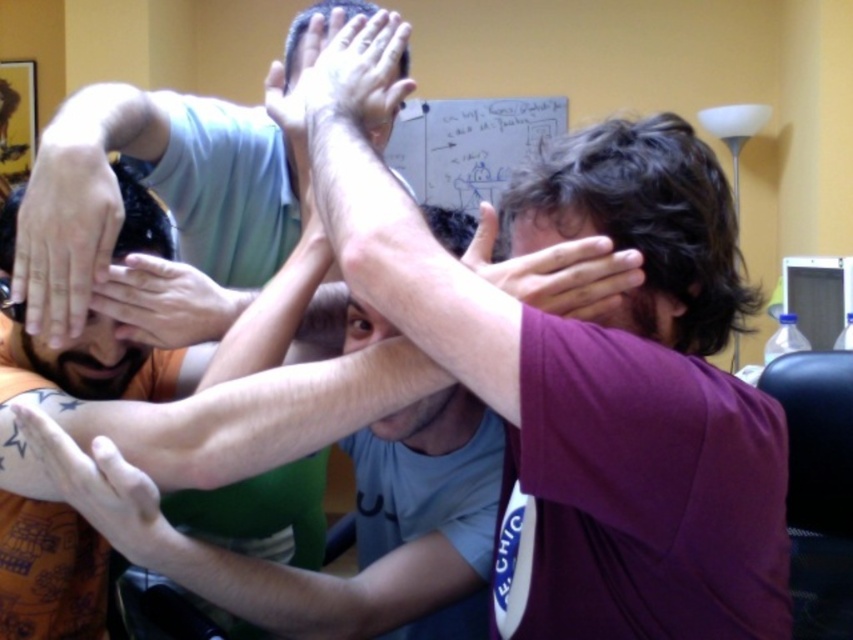
You are a delivery robot with a package that needs to be placed on the white plastic computer at right. You are currently positioned near the matte skin hand at upper center. Can you safely move the package to the computer without needing to navigate around any obstacles?

The distance between the matte skin hand at upper center and the white plastic computer at right is 1.99 meters. Since there are no obstacles mentioned in the scene description, the robot can safely move the package directly to the computer.

You are standing in a room where the whiteboard is 2 meters away from you. There is a point marked at coordinates point (287, 138). Can you reach this point without moving closer to it?

The point (287, 138) is 1.13 meters away from the camera, so you can reach it without moving closer since it is within your current distance of 2 meters.

You are a photographer adjusting your camera to capture the scene. The matte skin hand at center and the matte skin hand at upper center are part of the composition. If your camera has a minimum focus distance of 14 inches, will both hands be in focus?

The matte skin hand at center and the matte skin hand at upper center are 13.69 inches apart, which is less than the camera minimum focus distance of 14 inches. Therefore, the hands may not both be in focus.